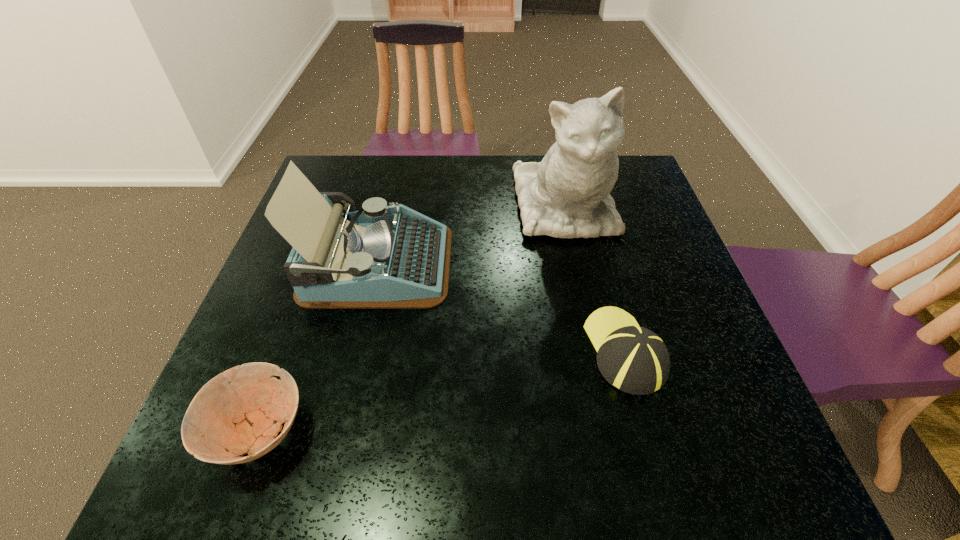
Image resolution: width=960 pixels, height=540 pixels. I want to click on vacant point located between the bowl and the cat, so click(411, 319).

This screenshot has width=960, height=540. I want to click on object identified as the second closest to the typewriter, so click(236, 411).

At what (x,y) coordinates should I click in order to perform the action: click on object that is the second closest to the baseball cap. Please return your answer as a coordinate pair (x, y). Looking at the image, I should click on (381, 257).

Where is `vacant area that satisfies the following two spatial constraints: 1. with the brim of the baseball cap facing forward; 2. on the typing side of the second tallest object`? Image resolution: width=960 pixels, height=540 pixels. vacant area that satisfies the following two spatial constraints: 1. with the brim of the baseball cap facing forward; 2. on the typing side of the second tallest object is located at coordinates (601, 264).

This screenshot has width=960, height=540. I want to click on free space that satisfies the following two spatial constraints: 1. with the brim of the baseball cap facing forward; 2. on the typing side of the typewriter, so click(x=601, y=264).

Identify the location of free space that satisfies the following two spatial constraints: 1. with the brim of the baseball cap facing forward; 2. on the typing side of the second tallest object. The width and height of the screenshot is (960, 540). (601, 264).

Where is `free location that satisfies the following two spatial constraints: 1. with the brim of the baseball cap facing forward; 2. on the typing side of the typewriter`? The image size is (960, 540). free location that satisfies the following two spatial constraints: 1. with the brim of the baseball cap facing forward; 2. on the typing side of the typewriter is located at coordinates (601, 264).